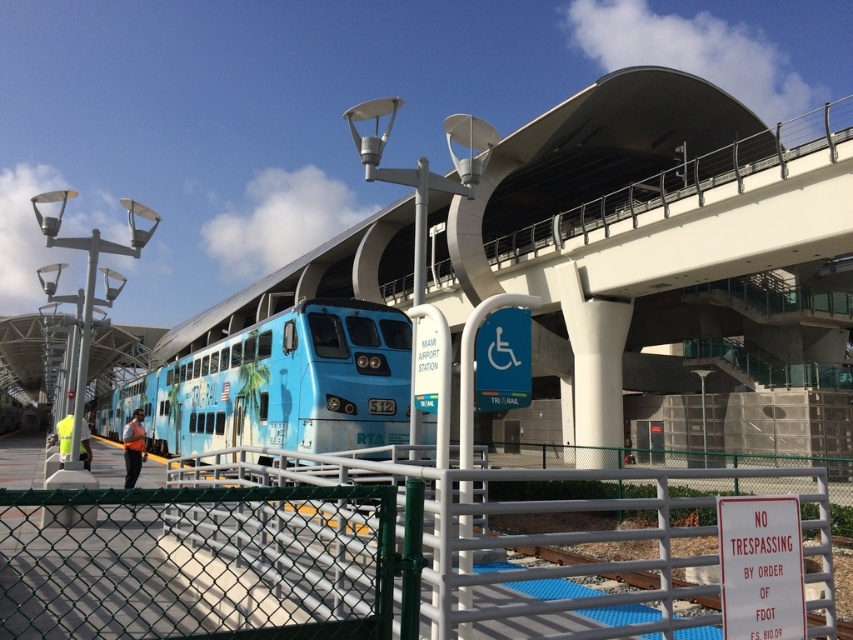
Between orange reflective vest at lower left and neon yellow vest at lower left, which one appears on the left side from the viewer's perspective?

orange reflective vest at lower left

Identify the location of orange reflective vest at lower left. (132, 445).

What do you see at coordinates (302, 556) in the screenshot? The width and height of the screenshot is (853, 640). I see `green chain-link fence at center` at bounding box center [302, 556].

Can you confirm if green chain-link fence at center is positioned below orange reflective vest at lower left?

Actually, green chain-link fence at center is above orange reflective vest at lower left.

Who is more forward, (332, 616) or (125, 449)?

A: Point (332, 616)

I want to click on green chain-link fence at center, so click(302, 556).

Is green chain-link fence at center positioned in front of neon yellow vest at lower left?

Yes, it is in front of neon yellow vest at lower left.

Does point (51, 557) come behind point (65, 426)?

No, it is in front of (65, 426).

The image size is (853, 640). Find the location of `green chain-link fence at center`. green chain-link fence at center is located at coordinates (302, 556).